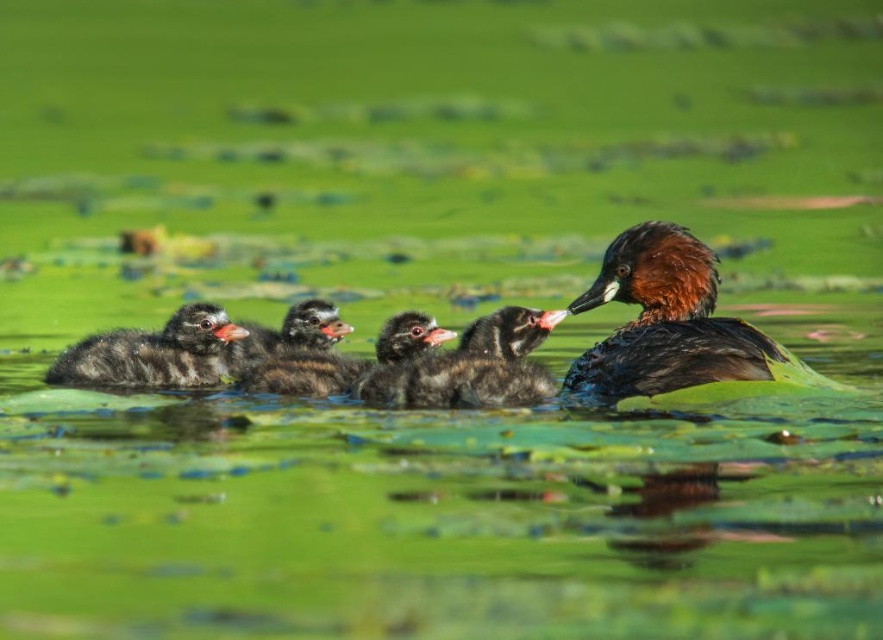
You are standing on the edge of a pond and see a dark brown fluffy duckling at center. If you want to toss a small pebble to make a ripple near the duckling without disturbing it, and you know your average pebble throw can reach 3 meters, will you be able to do so?

The dark brown fluffy duckling at center is 3.62 meters away from the viewer. Since your average pebble throw reaches 3 meters, which is shorter than the required distance, you won

You are a nature photographer observing the scene. You need to capture a photo where the dark brown fluffy ducklings at center and the black fluffy duckling at center are clearly visible. Which duckling group should you focus on to ensure they are in focus if your camera can only focus on the tallest subject?

You should focus on the dark brown fluffy ducklings at center because they are taller than the black fluffy duckling at center, ensuring they will be in focus.

You are a nature photographer observing the scene. You need to position your camera to capture the dark gray fluffy duckling at left and ensure it is centered in your shot. Given its current coordinates at point 0.553, 0.176, what adjustment should you make to the camera frame?

The dark gray fluffy duckling at left is located at point (155, 353). To center it, adjust the camera frame so the center aligns with these coordinates.